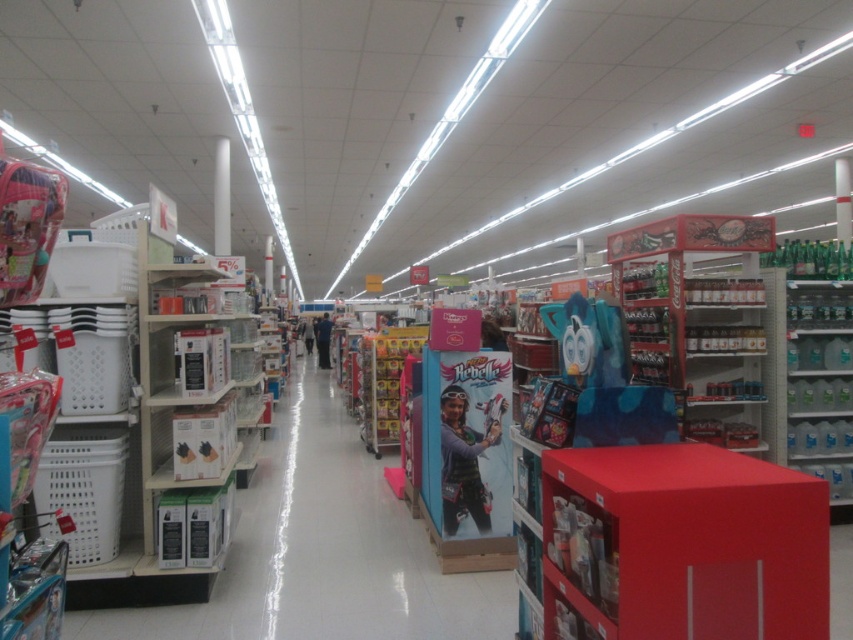
Question: Based on their relative distances, which object is farther from the matte black jacket at center?

Choices:
 (A) white glossy pillar at center
 (B) green plastic pillar at center

Answer: (B)

Question: Is white plastic basket at left bigger than green plastic pillar at center?

Choices:
 (A) yes
 (B) no

Answer: (A)

Question: Which point appears farthest from the camera in this image?

Choices:
 (A) (834, 198)
 (B) (216, 172)
 (C) (321, 346)
 (D) (328, 554)

Answer: (C)

Question: Does green plastic pillar at center come behind matte black jacket at center?

Choices:
 (A) no
 (B) yes

Answer: (A)

Question: Estimate the real-world distances between objects in this image. Which object is farther from the green plastic pillar at center?

Choices:
 (A) white plastic basket at left
 (B) white glossy pillar at center
 (C) matte black jacket at center

Answer: (C)

Question: Observing the image, what is the correct spatial positioning of white plastic basket at left in reference to matte black jacket at center?

Choices:
 (A) below
 (B) above

Answer: (A)